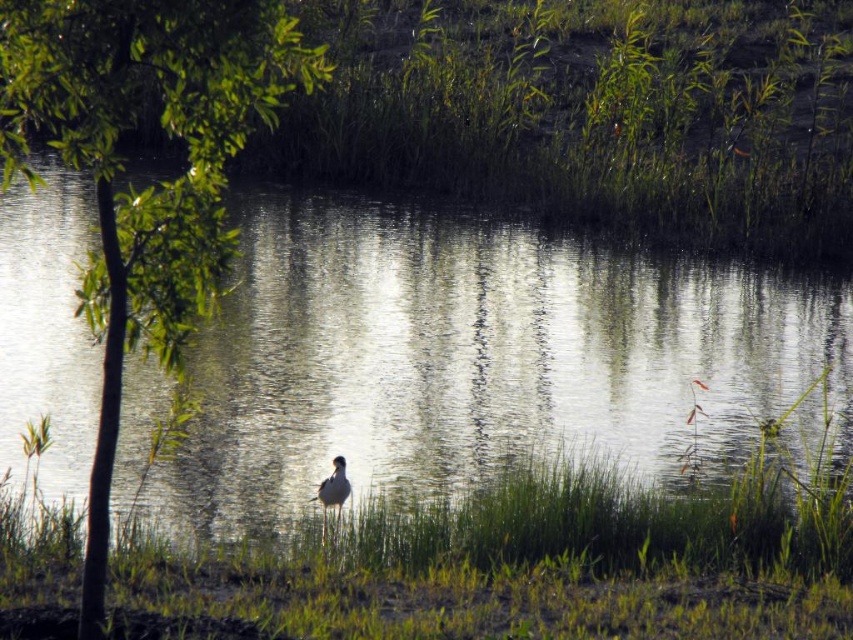
You are standing at the edge of the pond and see the clear water at center and the green grass at center. Which one is closer to you?

The clear water at center is closer to you than the green grass at center because it is further away.

You are a photographer aiming to capture a closeup of the white feathered bird at center while standing on the green grass at center. Can you reach the bird without moving from your current position?

The green grass at center and white feathered bird at center are 2.74 meters apart from each other. Since the distance is too far for a typical handheld camera, you would need a zoom lens to capture the bird without moving closer.

You are a photographer trying to capture the reflection of the clear water at center in your shot. Since the green grass at center is blocking the view, can you adjust your position to see the reflection better?

The clear water at center is located above the green grass at center, so you can lower your camera angle to capture the reflection by positioning it below the green grass at center.